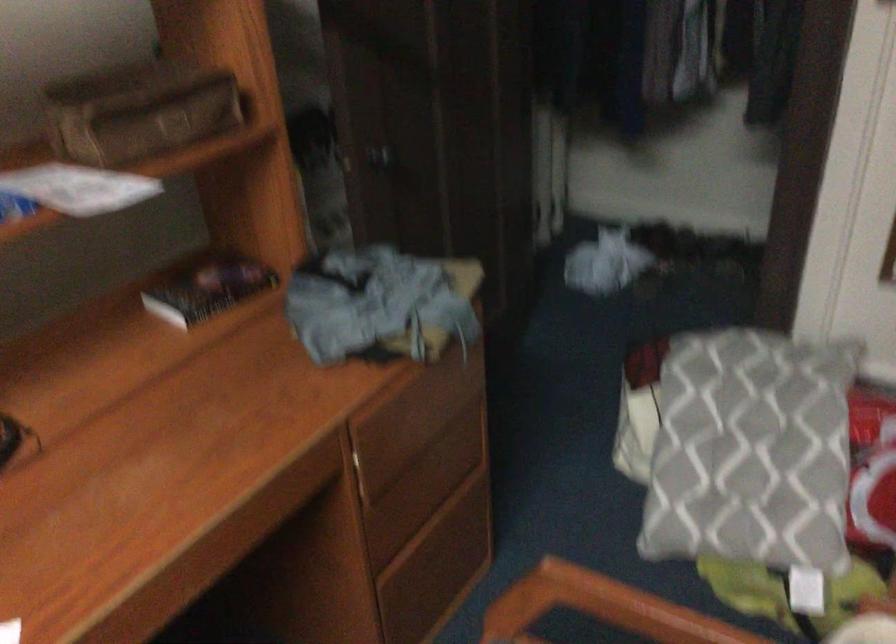
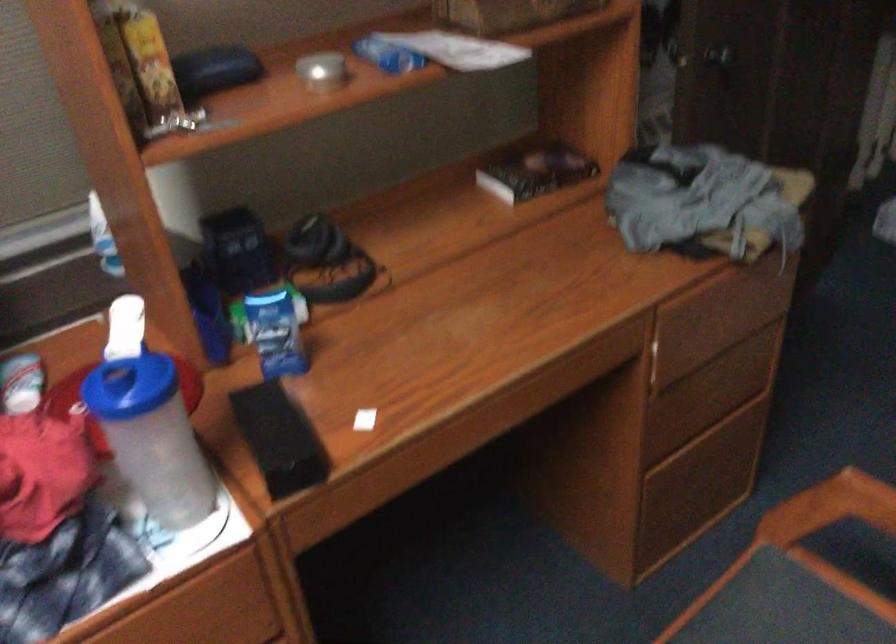
Find the pixel in the second image that matches the point at 208,292 in the first image.

(536, 172)